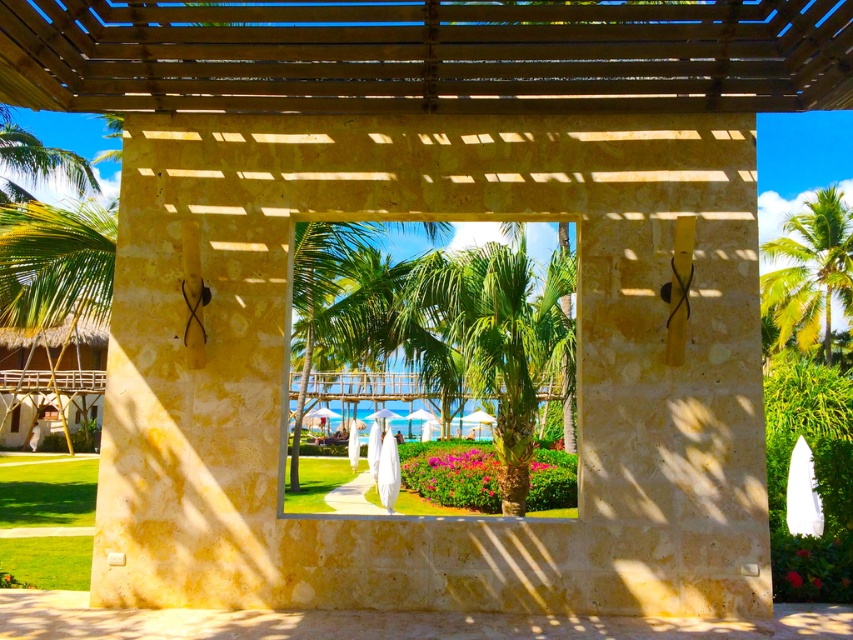
Does green leafy palm tree at center have a larger size compared to green leafy palm tree at upper right?

Correct, green leafy palm tree at center is larger in size than green leafy palm tree at upper right.

Consider the image. Between green leafy palm tree at center and green leafy palm tree at upper right, which one is positioned lower?

green leafy palm tree at center is lower down.

The width and height of the screenshot is (853, 640). What do you see at coordinates (514, 348) in the screenshot?
I see `green leafy palm tree at center` at bounding box center [514, 348].

You are a GUI agent. You are given a task and a screenshot of the screen. Output one action in this format:
    pyautogui.click(x=<x>, y=<y>)
    Task: Click on the green leafy palm tree at center
    This screenshot has height=640, width=853.
    Given the screenshot: What is the action you would take?
    pyautogui.click(x=514, y=348)